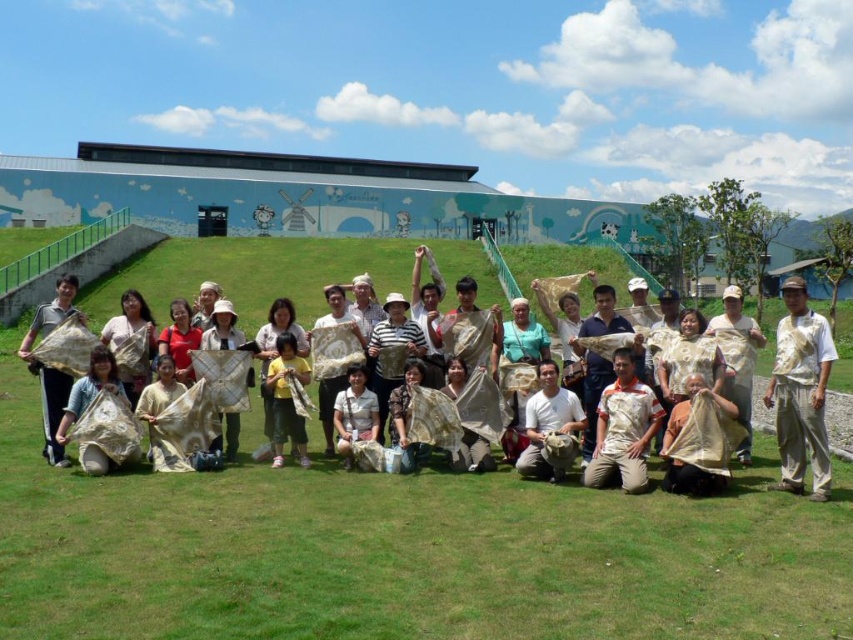
Question: Is light brown fabric at center below tan woven cloth at center?

Choices:
 (A) no
 (B) yes

Answer: (B)

Question: Is beige fabric hat at center to the right of light brown fabric at center from the viewer's perspective?

Choices:
 (A) no
 (B) yes

Answer: (B)

Question: Among these objects, which one is farthest from the camera?

Choices:
 (A) matte beige fabric at center
 (B) light brown fabric at center
 (C) yellow fabric at center
 (D) white matte shirt at center

Answer: (C)

Question: Which object is closer to the camera taking this photo?

Choices:
 (A) tan woven cloth at center
 (B) beige fabric bag at lower center

Answer: (B)

Question: Does matte beige fabric at center appear on the right side of tan woven cloth at center?

Choices:
 (A) yes
 (B) no

Answer: (B)

Question: Among these points, which one is farthest from the camera?

Choices:
 (A) coord(352,385)
 (B) coord(787,296)

Answer: (A)